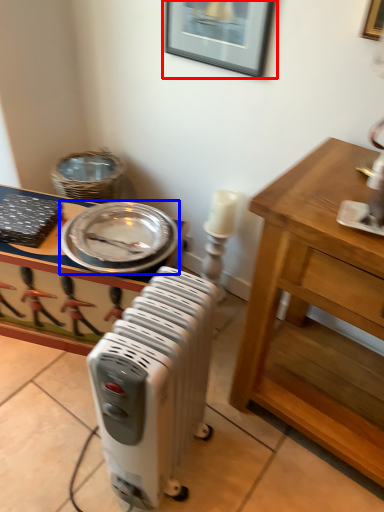
Question: Among these objects, which one is nearest to the camera, picture frame (highlighted by a red box) or platter (highlighted by a blue box)?

Choices:
 (A) picture frame
 (B) platter

Answer: (A)